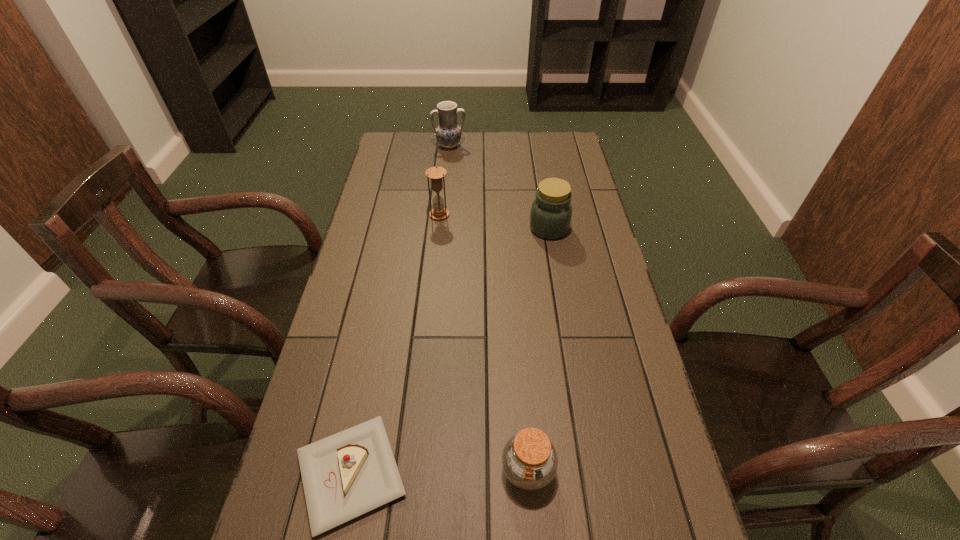
Identify the location of free spot between the fourth tallest object and the shortest object. This screenshot has height=540, width=960. (440, 472).

Image resolution: width=960 pixels, height=540 pixels. What are the coordinates of `free spot between the hourglass and the shortest object` in the screenshot? It's located at (396, 344).

You are a GUI agent. You are given a task and a screenshot of the screen. Output one action in this format:
    pyautogui.click(x=<x>, y=<y>)
    Task: Click on the free spot between the taller jar and the pottery
    
    Given the screenshot: What is the action you would take?
    pyautogui.click(x=499, y=187)

Where is `free space between the farthest object and the farther jar`? free space between the farthest object and the farther jar is located at coordinates (499, 187).

Identify the location of vacant space that is in between the shortest object and the farthest object. (400, 310).

You are a GUI agent. You are given a task and a screenshot of the screen. Output one action in this format:
    pyautogui.click(x=<x>, y=<y>)
    Task: Click on the free space that is in between the left jar and the cake
    This screenshot has height=540, width=960.
    Given the screenshot: What is the action you would take?
    pyautogui.click(x=440, y=472)

Find the location of a particular element. free space between the hourglass and the rightmost object is located at coordinates (494, 221).

Identify the location of unoccupied area between the hourglass and the shortest object. The width and height of the screenshot is (960, 540). (396, 344).

This screenshot has height=540, width=960. What are the coordinates of `object that stands as the third closest to the cake` in the screenshot? It's located at (436, 174).

Where is `object that is the second closest to the shortest object`? The image size is (960, 540). object that is the second closest to the shortest object is located at coordinates (551, 211).